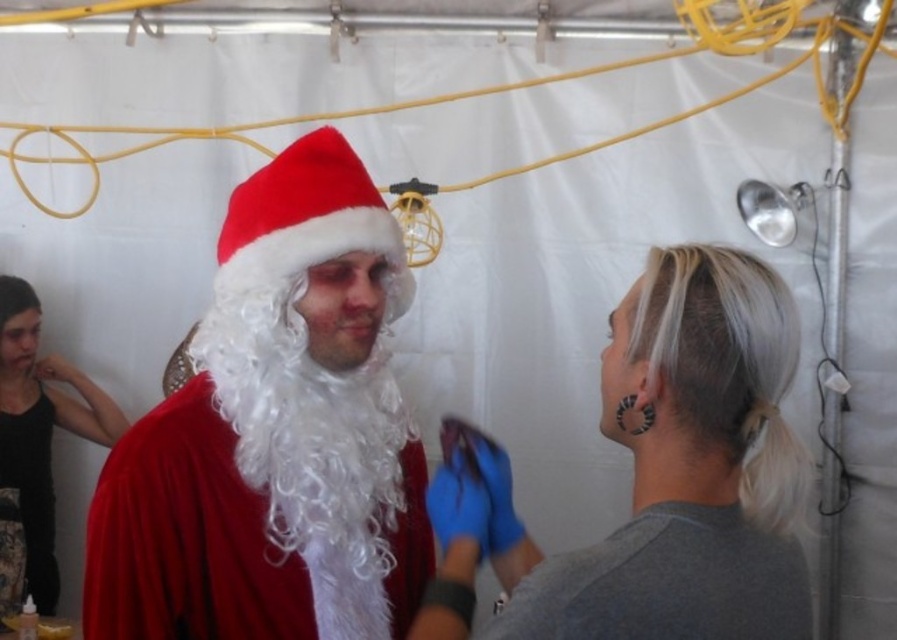
Question: Which of the following is the farthest from the observer?

Choices:
 (A) velvet black tank top at lower left
 (B) matte red santa hat at upper left

Answer: (A)

Question: Does gray matte shirt at lower right have a larger size compared to black matte tank top at left?

Choices:
 (A) no
 (B) yes

Answer: (A)

Question: Can you confirm if velvet red santa claus at center is positioned to the right of gray matte shirt at lower right?

Choices:
 (A) yes
 (B) no

Answer: (B)

Question: Can you confirm if black matte tank top at left is positioned below white fluffy beard at center?

Choices:
 (A) no
 (B) yes

Answer: (B)

Question: Which of these objects is positioned closest to the black matte tank top at left?

Choices:
 (A) gray matte shirt at lower right
 (B) velvet red santa claus at center
 (C) white fluffy beard at center
 (D) matte red santa hat at upper left

Answer: (B)

Question: Among these objects, which one is farthest from the camera?

Choices:
 (A) gray matte shirt at lower right
 (B) white fluffy beard at center
 (C) velvet red santa claus at center
 (D) velvet black tank top at lower left

Answer: (D)